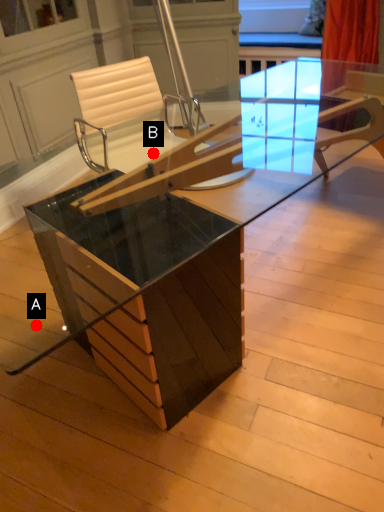
Question: Two points are circled on the image, labeled by A and B beside each circle. Which point appears closest to the camera in this image?

Choices:
 (A) A is closer
 (B) B is closer

Answer: (A)